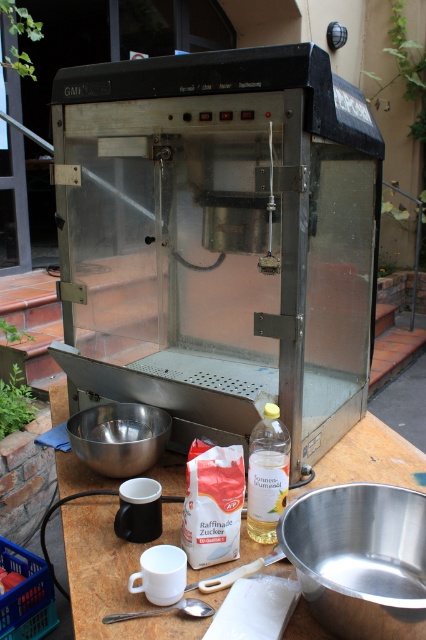
Question: Which point is closer to the camera?

Choices:
 (A) (x=120, y=541)
 (B) (x=152, y=310)
 (C) (x=259, y=508)
 (D) (x=100, y=424)

Answer: (C)

Question: Can you confirm if metallic table at center is wider than clear plastic bottle at center?

Choices:
 (A) no
 (B) yes

Answer: (B)

Question: Which object appears farthest from the camera in this image?

Choices:
 (A) white matte sugar packet at lower center
 (B) shiny metallic bowl at lower left
 (C) clear plastic bottle at center
 (D) metallic table at center

Answer: (B)

Question: Is white matte sugar packet at lower center to the left of shiny metallic bowl at lower left from the viewer's perspective?

Choices:
 (A) yes
 (B) no

Answer: (B)

Question: Is metallic table at center bigger than shiny metallic bowl at lower left?

Choices:
 (A) no
 (B) yes

Answer: (B)

Question: Which point is closer to the camera?

Choices:
 (A) white matte sugar packet at lower center
 (B) shiny metallic bowl at lower left

Answer: (A)